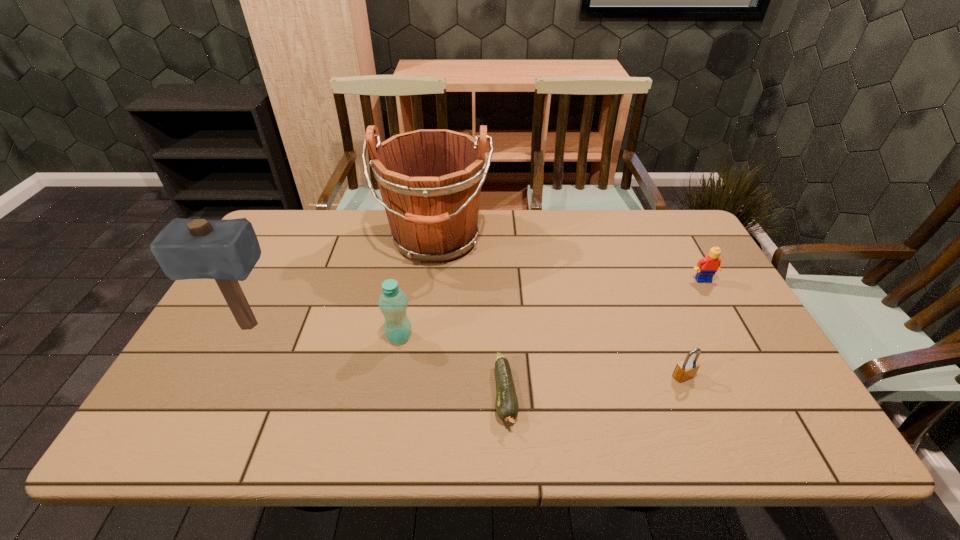
The width and height of the screenshot is (960, 540). What are the coordinates of `free point between the third tallest object and the leftmost object` in the screenshot? It's located at (324, 331).

Find the location of a particular element. The width and height of the screenshot is (960, 540). free point between the shortest object and the mallet is located at coordinates (376, 360).

Where is `free space between the zucchini and the mallet`? free space between the zucchini and the mallet is located at coordinates (376, 360).

You are a GUI agent. You are given a task and a screenshot of the screen. Output one action in this format:
    pyautogui.click(x=<x>, y=<y>)
    Task: Click on the blank region between the fifth tallest object and the fourth shortest object
    Image resolution: width=960 pixels, height=540 pixels.
    Given the screenshot: What is the action you would take?
    pyautogui.click(x=541, y=356)

You are a GUI agent. You are given a task and a screenshot of the screen. Output one action in this format:
    pyautogui.click(x=<x>, y=<y>)
    Task: Click on the object that is the third closest to the mallet
    Image resolution: width=960 pixels, height=540 pixels.
    Given the screenshot: What is the action you would take?
    pyautogui.click(x=507, y=407)

Locate which object ranks second in proximity to the fourth tallest object. Please provide its 2D coordinates. Your answer should be formatted as a tuple, i.e. [(x, y)], where the tuple contains the x and y coordinates of a point satisfying the conditions above.

[(430, 180)]

Image resolution: width=960 pixels, height=540 pixels. I want to click on vacant space that satisfies the following two spatial constraints: 1. with the handle on the side of the bucket; 2. on the right side of the padlock, so (x=419, y=376).